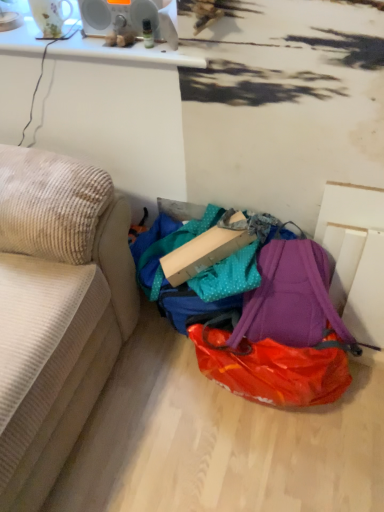
Question: Can you confirm if purple fabric backpack at lower center is shorter than beige corduroy couch at left?

Choices:
 (A) yes
 (B) no

Answer: (A)

Question: Considering the relative sizes of purple fabric backpack at lower center and beige corduroy couch at left in the image provided, is purple fabric backpack at lower center taller than beige corduroy couch at left?

Choices:
 (A) no
 (B) yes

Answer: (A)

Question: From a real-world perspective, is purple fabric backpack at lower center on top of beige corduroy couch at left?

Choices:
 (A) yes
 (B) no

Answer: (B)

Question: Can you confirm if purple fabric backpack at lower center is wider than beige corduroy couch at left?

Choices:
 (A) yes
 (B) no

Answer: (B)

Question: Is purple fabric backpack at lower center facing towards beige corduroy couch at left?

Choices:
 (A) yes
 (B) no

Answer: (B)

Question: Is purple fabric backpack at lower center to the right of beige corduroy couch at left from the viewer's perspective?

Choices:
 (A) yes
 (B) no

Answer: (A)

Question: Are purple fabric backpack at lower center and cardboard box at center making contact?

Choices:
 (A) yes
 (B) no

Answer: (B)

Question: Is purple fabric backpack at lower center positioned behind cardboard box at center?

Choices:
 (A) yes
 (B) no

Answer: (B)

Question: From the image's perspective, is purple fabric backpack at lower center located above cardboard box at center?

Choices:
 (A) no
 (B) yes

Answer: (A)

Question: Is purple fabric backpack at lower center shorter than cardboard box at center?

Choices:
 (A) yes
 (B) no

Answer: (B)

Question: Is purple fabric backpack at lower center bigger than cardboard box at center?

Choices:
 (A) yes
 (B) no

Answer: (A)

Question: Does purple fabric backpack at lower center have a smaller size compared to cardboard box at center?

Choices:
 (A) yes
 (B) no

Answer: (B)

Question: Does beige corduroy couch at left appear on the left side of purple fabric backpack at lower center?

Choices:
 (A) no
 (B) yes

Answer: (B)